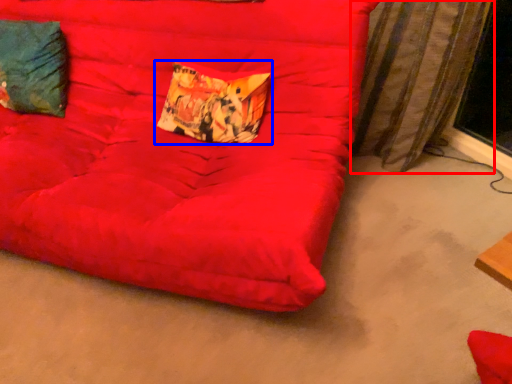
Question: Which of the following is the closest to the observer, curtain (highlighted by a red box) or pillow (highlighted by a blue box)?

Choices:
 (A) curtain
 (B) pillow

Answer: (A)